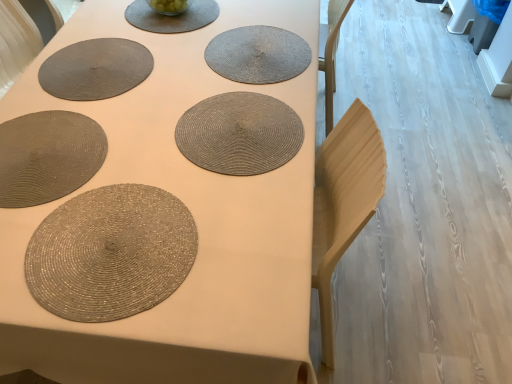
Where is `vacant space in between rattan placemat at center, the second coaster positioned from the back, and rattan placemat at center, which appears as the first coaster when viewed from the back`? The width and height of the screenshot is (512, 384). vacant space in between rattan placemat at center, the second coaster positioned from the back, and rattan placemat at center, which appears as the first coaster when viewed from the back is located at coordinates (242, 85).